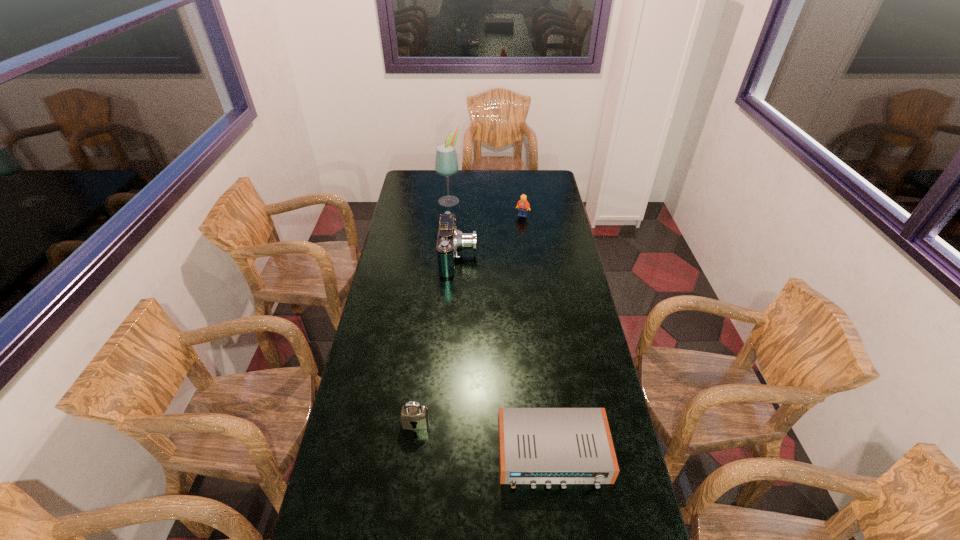
The width and height of the screenshot is (960, 540). Find the location of `the farthest object`. the farthest object is located at coordinates (446, 163).

Locate an element on the screen. The width and height of the screenshot is (960, 540). the tallest object is located at coordinates (446, 163).

This screenshot has height=540, width=960. Identify the location of camcorder. (450, 240).

The width and height of the screenshot is (960, 540). Find the location of `the second tallest object`. the second tallest object is located at coordinates (450, 240).

Image resolution: width=960 pixels, height=540 pixels. I want to click on the second farthest object, so click(x=522, y=205).

Where is `padlock`? padlock is located at coordinates (414, 416).

At what (x,y) coordinates should I click in order to perform the action: click on radio receiver. Please return your answer as a coordinate pair (x, y). The width and height of the screenshot is (960, 540). Looking at the image, I should click on (548, 446).

This screenshot has height=540, width=960. In order to click on blank space located 0.320m on the front of the farthest object in this screenshot , I will do `click(445, 246)`.

The height and width of the screenshot is (540, 960). I want to click on vacant space located on the front-facing side of the fourth shortest object, so click(561, 258).

Find the location of `vacant space located 0.360m on the front-facing side of the second farthest object`. vacant space located 0.360m on the front-facing side of the second farthest object is located at coordinates (529, 265).